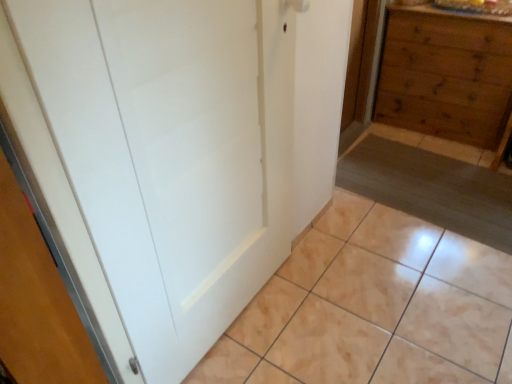
Question: Considering the positions of white matte door at center and beige glossy tile at lower center in the image, is white matte door at center taller or shorter than beige glossy tile at lower center?

Choices:
 (A) tall
 (B) short

Answer: (A)

Question: Is white matte door at center in front of or behind beige glossy tile at lower center in the image?

Choices:
 (A) front
 (B) behind

Answer: (A)

Question: Estimate the real-world distances between objects in this image. Which object is farther from the beige glossy tile at lower center?

Choices:
 (A) wooden chest of drawers at right
 (B) white matte door at center

Answer: (A)

Question: Which object is positioned farthest from the beige glossy tile at lower center?

Choices:
 (A) wooden chest of drawers at right
 (B) white matte door at center

Answer: (A)